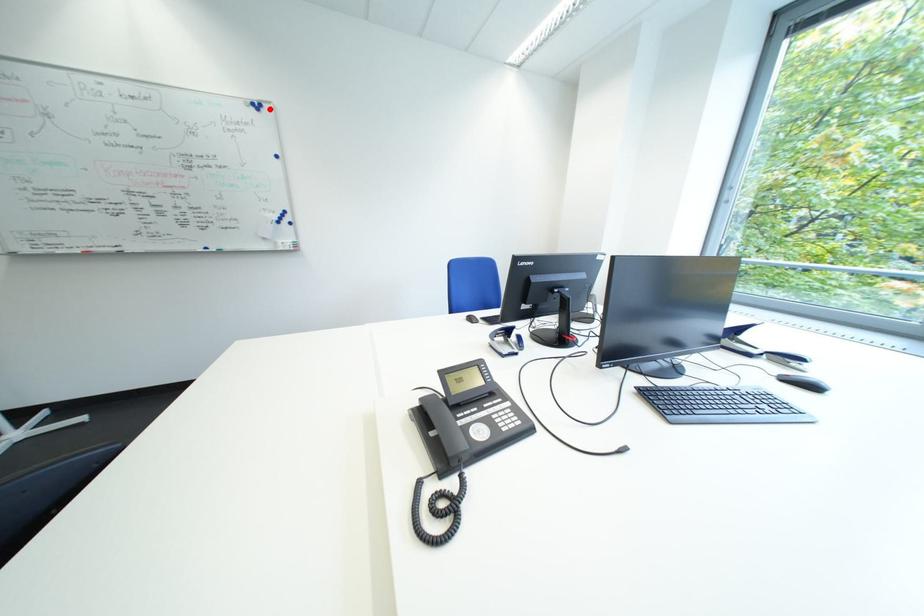
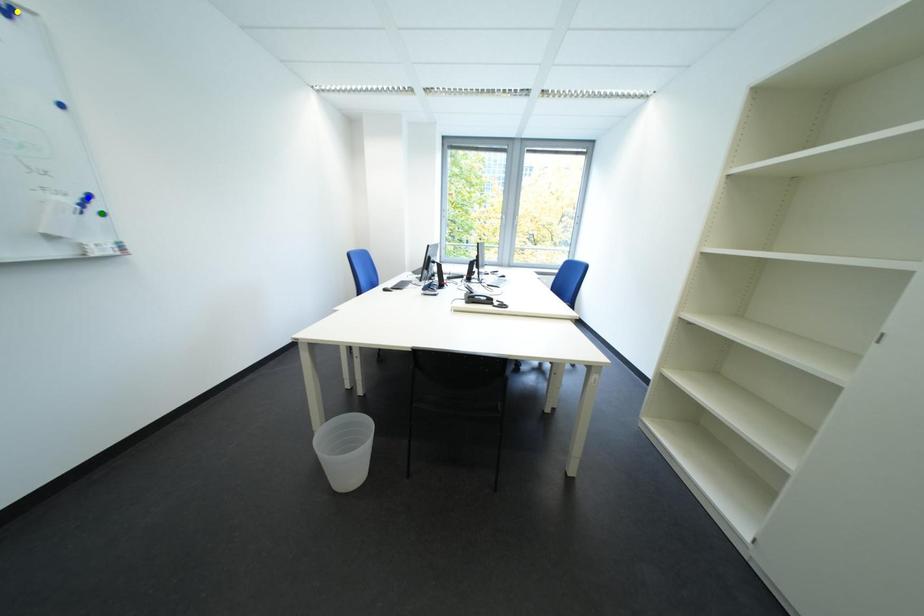
Question: I am providing you with two images of the same scene from different viewpoints. A red point is marked on the first image. You are given multiple points on the second image. Which point in image 2 is actually the same real-world point as the red point in image 1?

Choices:
 (A) green point
 (B) blue point
 (C) yellow point

Answer: (C)